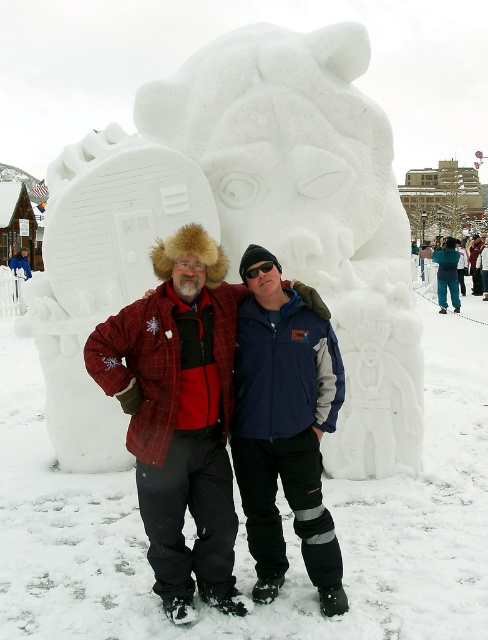
Does white snow sculpture at center have a larger size compared to plaid wool jacket at center?

No.

Identify the location of white snow sculpture at center. (241, 228).

Which is behind, point (284, 188) or point (266, 556)?

Positioned behind is point (284, 188).

Does white snow sculpture at center have a greater width compared to navy blue jacket at center?

No, white snow sculpture at center is not wider than navy blue jacket at center.

What do you see at coordinates (241, 228) in the screenshot? Image resolution: width=488 pixels, height=640 pixels. I see `white snow sculpture at center` at bounding box center [241, 228].

Locate an element on the screen. white snow sculpture at center is located at coordinates (241, 228).

Looking at this image, does plaid wool jacket at center have a greater width compared to navy blue jacket at center?

Yes, plaid wool jacket at center is wider than navy blue jacket at center.

Between plaid wool jacket at center and navy blue jacket at center, which one is positioned lower?

Positioned lower is navy blue jacket at center.

Describe the element at coordinates (180, 413) in the screenshot. The width and height of the screenshot is (488, 640). I see `plaid wool jacket at center` at that location.

I want to click on plaid wool jacket at center, so click(180, 413).